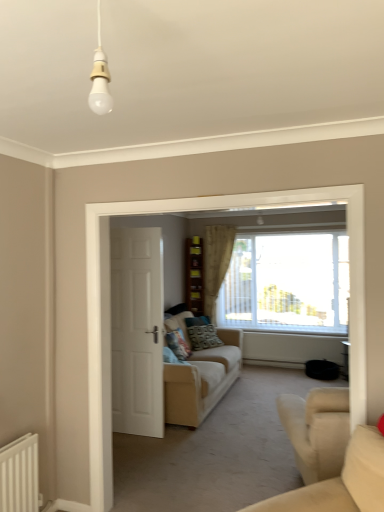
Question: From the image's perspective, is beige fabric couch at center, the 1th studio couch in the back-to-front sequence, above or below white matte door at center?

Choices:
 (A) above
 (B) below

Answer: (B)

Question: Considering the positions of beige fabric couch at center, the 1th studio couch in the back-to-front sequence, and white matte door at center in the image, is beige fabric couch at center, the 1th studio couch in the back-to-front sequence, taller or shorter than white matte door at center?

Choices:
 (A) tall
 (B) short

Answer: (B)

Question: Which is farther from the beige fabric couch at center, placed as the second studio couch when sorted from front to back?

Choices:
 (A) beige fabric curtain at center
 (B) beige fabric couch at lower right, placed as the first studio couch when sorted from front to back
 (C) patterned fabric pillow at center, which appears as the 2th pillow when viewed from the right
 (D) wooden shelves at center
 (E) white matte door at center

Answer: (B)

Question: Estimate the real-world distances between objects in this image. Which object is farther from the beige fabric curtain at center?

Choices:
 (A) patterned fabric pillow at center, which appears as the first pillow when viewed from the front
 (B) white matte door at center
 (C) patterned fabric pillow at center, which ranks as the second pillow in left-to-right order
 (D) beige fabric couch at center, placed as the second studio couch when sorted from front to back
 (E) wooden shelves at center

Answer: (B)